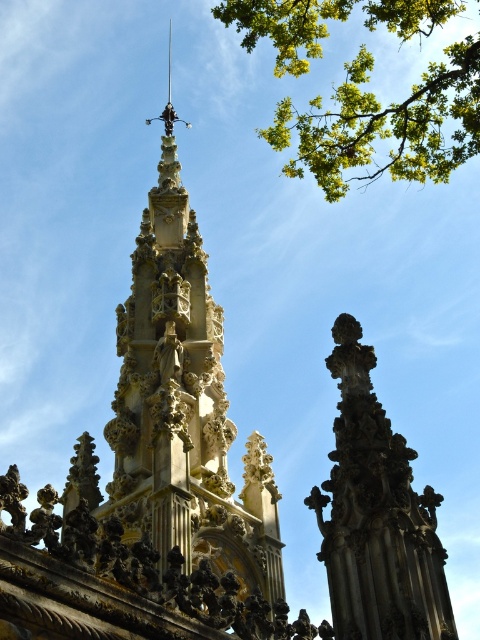
Question: Can you confirm if golden stone spire at center is smaller than carved stone spire at center?

Choices:
 (A) no
 (B) yes

Answer: (A)

Question: Which object appears farthest from the camera in this image?

Choices:
 (A) carved stone spire at center
 (B) green leafy branch at upper right
 (C) golden stone spire at center

Answer: (B)

Question: Which object is closer to the camera taking this photo?

Choices:
 (A) green leafy branch at upper right
 (B) golden stone spire at center
 (C) carved stone spire at center

Answer: (B)

Question: Among these objects, which one is farthest from the camera?

Choices:
 (A) green leafy branch at upper right
 (B) golden stone spire at center
 (C) carved stone spire at center

Answer: (A)

Question: Can you confirm if golden stone spire at center is smaller than green leafy branch at upper right?

Choices:
 (A) yes
 (B) no

Answer: (A)

Question: From the image, what is the correct spatial relationship of golden stone spire at center in relation to carved stone spire at center?

Choices:
 (A) above
 (B) below

Answer: (A)